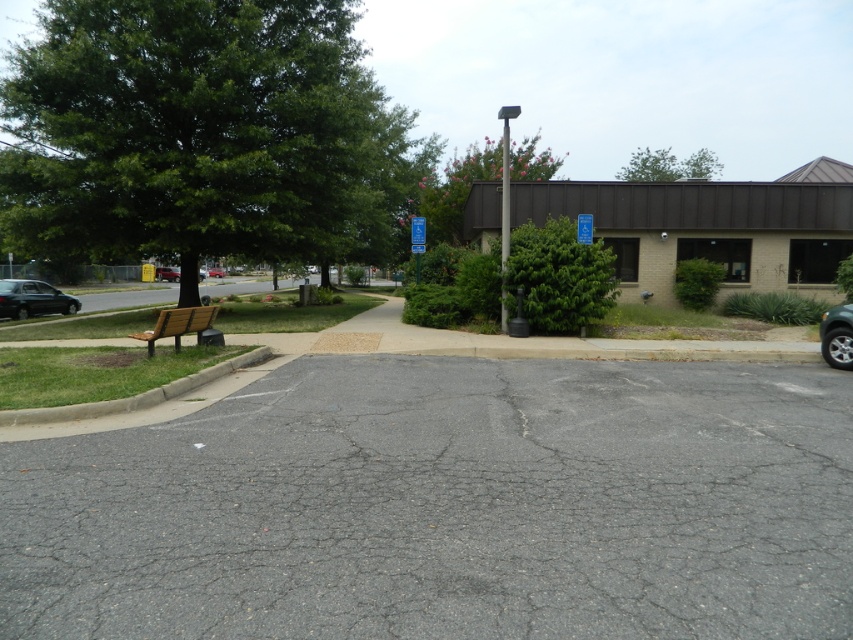
Is gray asphalt parking lot at center to the right of green leafy tree at upper center from the viewer's perspective?

No, gray asphalt parking lot at center is not to the right of green leafy tree at upper center.

Identify the location of gray asphalt parking lot at center. (447, 506).

Which of these two, green leafy tree at upper center or metallic red car at center, stands taller?

With more height is green leafy tree at upper center.

Which of these two, green leafy tree at upper center or metallic red car at center, stands shorter?

With less height is metallic red car at center.

Is point (624, 179) positioned behind point (225, 273)?

That is True.

The image size is (853, 640). I want to click on green leafy tree at upper center, so click(668, 164).

Is point (15, 285) closer to camera compared to point (846, 369)?

That is False.

Can you confirm if matte black car at left is thinner than silver metallic car at right?

No.

Is point (16, 285) closer to camera compared to point (842, 305)?

No, it is not.

Identify the location of matte black car at left. (33, 300).